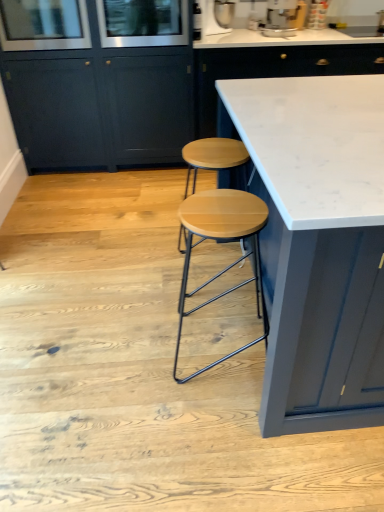
Question: Does white marble countertop at center, which ranks as the second cabinetry in left-to-right order, come in front of clear glass screen door at upper left, which ranks as the first screen door in left-to-right order?

Choices:
 (A) no
 (B) yes

Answer: (A)

Question: Is white marble countertop at center, which ranks as the second cabinetry in left-to-right order, looking in the opposite direction of clear glass screen door at upper left, acting as the 2th screen door starting from the right?

Choices:
 (A) yes
 (B) no

Answer: (B)

Question: Is clear glass screen door at upper left, acting as the 2th screen door starting from the right, inside white marble countertop at center, the 1th cabinetry viewed from the right?

Choices:
 (A) yes
 (B) no

Answer: (B)

Question: Does white marble countertop at center, the 1th cabinetry viewed from the right, have a larger size compared to clear glass screen door at upper left, which ranks as the first screen door in left-to-right order?

Choices:
 (A) yes
 (B) no

Answer: (A)

Question: Is white marble countertop at center, the 1th cabinetry viewed from the right, to the left of clear glass screen door at upper left, acting as the 2th screen door starting from the right, from the viewer's perspective?

Choices:
 (A) yes
 (B) no

Answer: (B)

Question: Is the depth of white marble countertop at center, which ranks as the second cabinetry in left-to-right order, greater than that of clear glass screen door at upper left, which ranks as the first screen door in left-to-right order?

Choices:
 (A) yes
 (B) no

Answer: (A)

Question: Does white marble countertop at center appear on the left side of metallic silver stand mixer at upper center, placed as the first appliance when sorted from left to right?

Choices:
 (A) no
 (B) yes

Answer: (A)

Question: Can you confirm if white marble countertop at center is taller than metallic silver stand mixer at upper center, marked as the 2th appliance in a right-to-left arrangement?

Choices:
 (A) yes
 (B) no

Answer: (A)

Question: Is metallic silver stand mixer at upper center, marked as the 2th appliance in a right-to-left arrangement, a part of white marble countertop at center?

Choices:
 (A) yes
 (B) no

Answer: (B)

Question: Is white marble countertop at center turned away from metallic silver stand mixer at upper center, placed as the first appliance when sorted from left to right?

Choices:
 (A) yes
 (B) no

Answer: (A)

Question: From a real-world perspective, is white marble countertop at center under metallic silver stand mixer at upper center, placed as the first appliance when sorted from left to right?

Choices:
 (A) yes
 (B) no

Answer: (A)

Question: Are white marble countertop at center and metallic silver stand mixer at upper center, placed as the first appliance when sorted from left to right, making contact?

Choices:
 (A) yes
 (B) no

Answer: (B)

Question: Does clear glass screen door at upper left, which ranks as the first screen door in left-to-right order, come in front of metallic silver coffee machine at upper center, the first appliance when ordered from right to left?

Choices:
 (A) no
 (B) yes

Answer: (B)